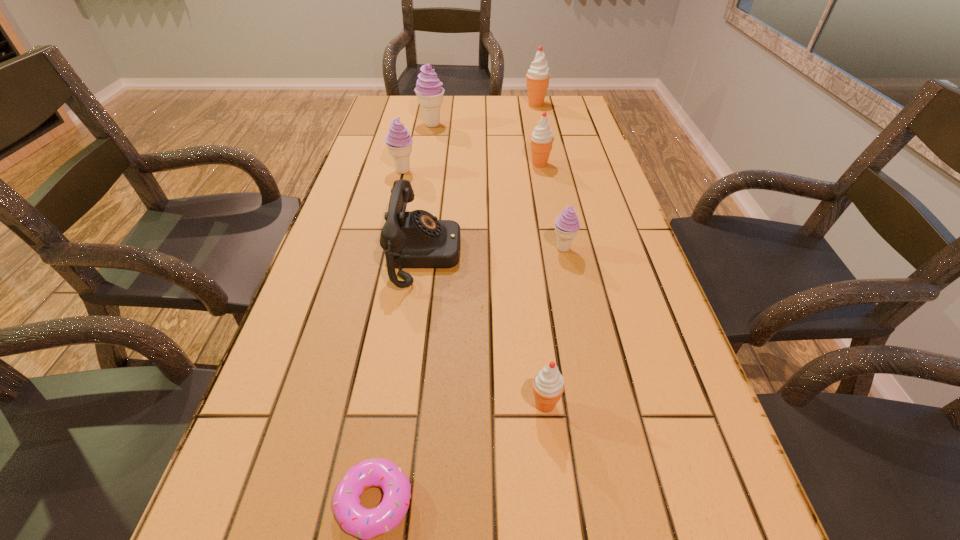
The width and height of the screenshot is (960, 540). In the image, there is a desktop. Identify the location of free space at the far edge. (480, 98).

In the image, there is a desktop. At what (x,y) coordinates should I click in order to perform the action: click on vacant space at the left edge. Please return your answer as a coordinate pair (x, y). Looking at the image, I should click on (372, 300).

At what (x,y) coordinates should I click in order to perform the action: click on blank space at the right edge of the desktop. Please return your answer as a coordinate pair (x, y). This screenshot has width=960, height=540. Looking at the image, I should click on (568, 190).

Locate an element on the screen. The height and width of the screenshot is (540, 960). blank area at the far right corner is located at coordinates (579, 112).

Image resolution: width=960 pixels, height=540 pixels. What are the coordinates of `vacant region between the second farthest purple icecream and the nearest red icecream` in the screenshot? It's located at (474, 288).

The width and height of the screenshot is (960, 540). Find the location of `vacant space that's between the biggest purple icecream and the biggest red icecream`. vacant space that's between the biggest purple icecream and the biggest red icecream is located at coordinates (484, 114).

This screenshot has width=960, height=540. I want to click on vacant area that lies between the nearest purple icecream and the second biggest red icecream, so click(551, 206).

Locate an element on the screen. This screenshot has height=540, width=960. empty space that is in between the seventh farthest object and the telephone is located at coordinates (485, 329).

Identify the location of free space between the second nearest icecream and the second biggest purple icecream. The image size is (960, 540). (483, 210).

Identify which object is the third nearest to the farthest purple icecream. Please provide its 2D coordinates. Your answer should be formatted as a tuple, i.e. [(x, y)], where the tuple contains the x and y coordinates of a point satisfying the conditions above.

[(542, 138)]